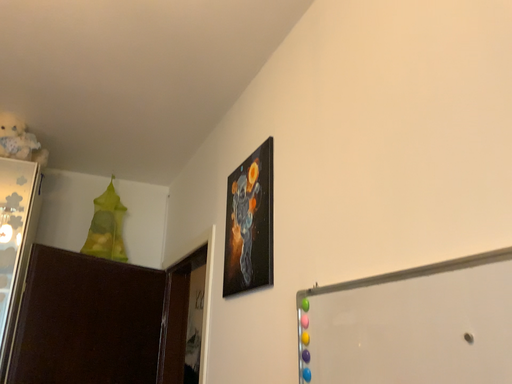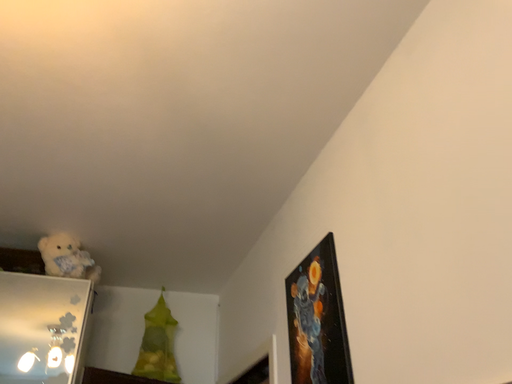
Question: How did the camera likely rotate when shooting the video?

Choices:
 (A) rotated downward
 (B) rotated upward

Answer: (B)